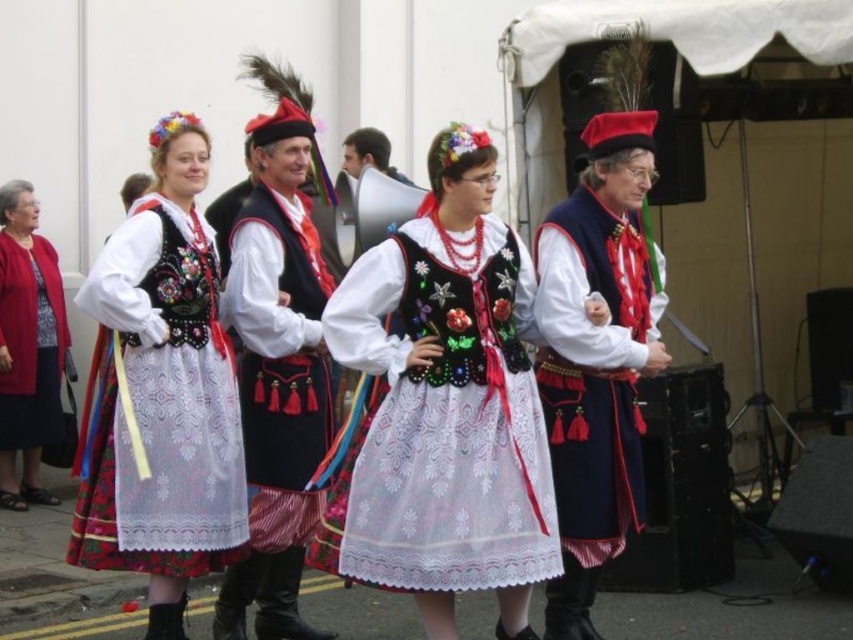
Question: Which of the following is the closest to the observer?

Choices:
 (A) matte black dress at center
 (B) matte black vest at center
 (C) matte red cardigan at left
 (D) embroidered fabric dress at center

Answer: (D)

Question: Estimate the real-world distances between objects in this image. Which object is farther from the embroidered fabric dress at center?

Choices:
 (A) matte red cardigan at left
 (B) velvet dark blue vest at center

Answer: (A)

Question: Can you confirm if velvet dark blue vest at center is thinner than matte red cardigan at left?

Choices:
 (A) yes
 (B) no

Answer: (B)

Question: Does embroidered fabric dress at center appear on the left side of matte black vest at center?

Choices:
 (A) no
 (B) yes

Answer: (A)

Question: Is the position of matte black dress at center more distant than that of velvet dark blue vest at center?

Choices:
 (A) yes
 (B) no

Answer: (B)

Question: Based on their relative distances, which object is nearer to the matte black vest at center?

Choices:
 (A) matte black dress at center
 (B) matte red cardigan at left
 (C) embroidered fabric dress at center
 (D) velvet dark blue vest at center

Answer: (A)